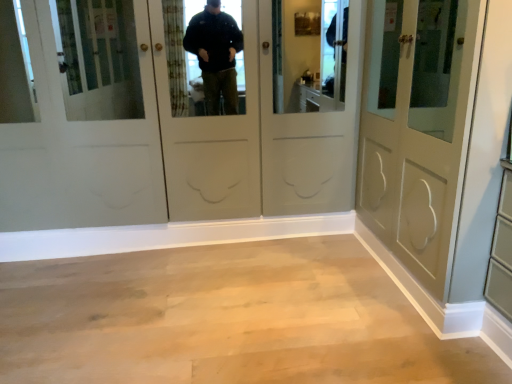
Where is `free location above light wood floor at center (from a real-world perspective)`? The height and width of the screenshot is (384, 512). free location above light wood floor at center (from a real-world perspective) is located at coordinates (304, 300).